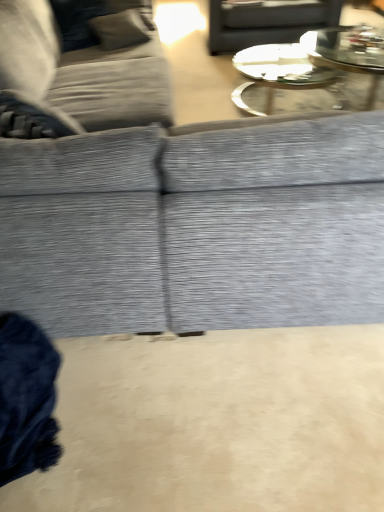
Question: From the image's perspective, relative to matte gray tray at upper center, is textured gray couch at upper left, which is counted as the 2th studio couch, starting from the right, above or below?

Choices:
 (A) above
 (B) below

Answer: (B)

Question: From a real-world perspective, is textured gray couch at upper left, which is counted as the 2th studio couch, starting from the right, positioned above or below matte gray tray at upper center?

Choices:
 (A) above
 (B) below

Answer: (A)

Question: Based on their relative distances, which object is nearer to the textured gray couch at upper left, which is counted as the 2th studio couch, starting from the right?

Choices:
 (A) textured gray fabric couch at center, which is the second studio couch from left to right
 (B) matte gray tray at upper center
 (C) clear glass coffee table at upper center

Answer: (C)

Question: Considering the real-world distances, which object is closest to the textured gray fabric couch at center, positioned as the 1th studio couch in right-to-left order?

Choices:
 (A) textured gray couch at upper left, which ranks as the first studio couch in left-to-right order
 (B) clear glass coffee table at upper center
 (C) matte gray tray at upper center

Answer: (A)